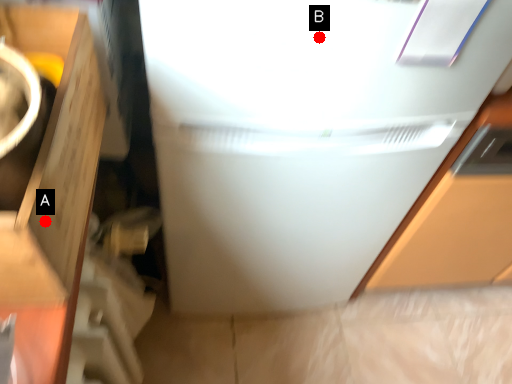
Question: Two points are circled on the image, labeled by A and B beside each circle. Which of the following is the closest to the observer?

Choices:
 (A) A is closer
 (B) B is closer

Answer: (A)